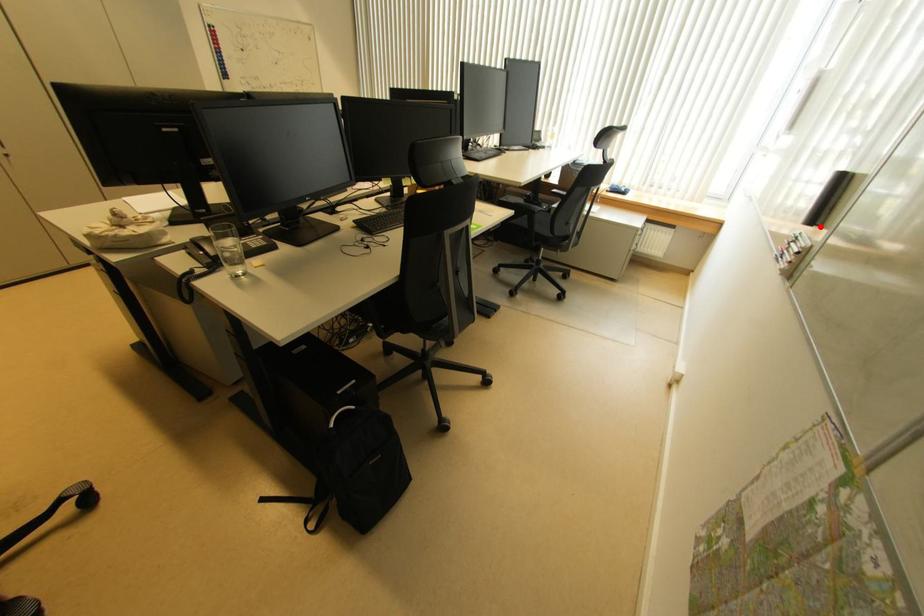
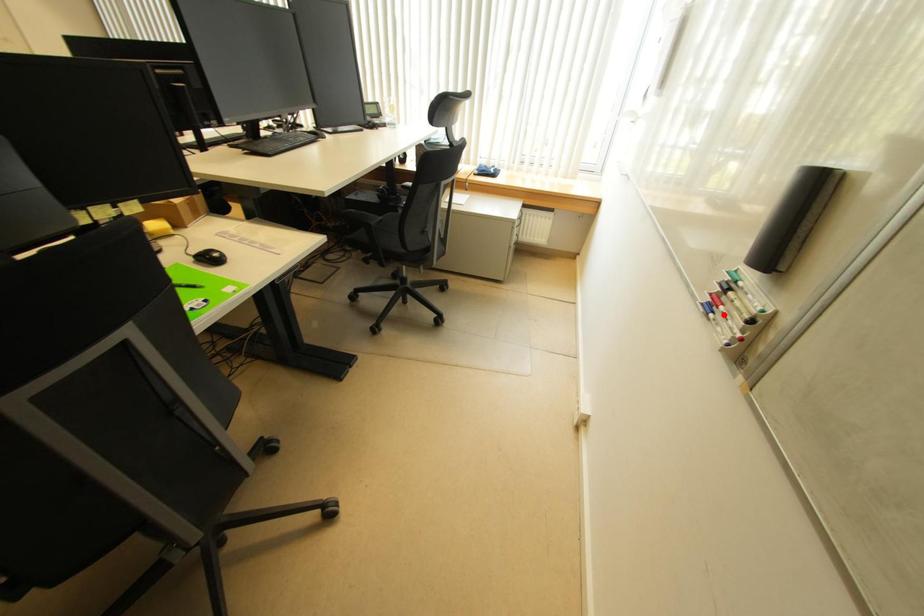
I am providing you with two images of the same scene from different viewpoints. A red point is marked on the first image and another point is marked on the second image. Do the highlighted points in image1 and image2 indicate the same real-world spot?

No